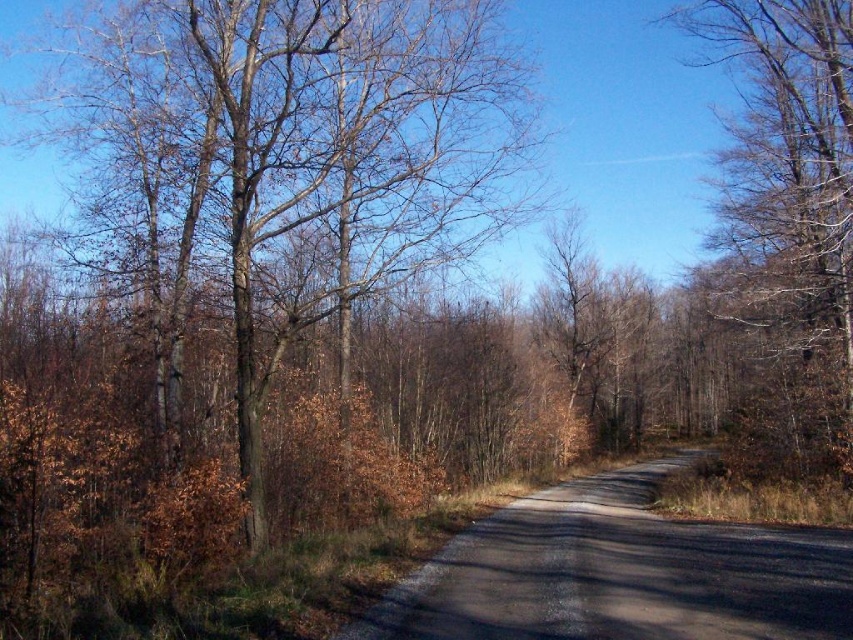
Question: Which point is farther to the camera?

Choices:
 (A) brown bark tree at right
 (B) brown bark tree at left

Answer: (A)

Question: Among these points, which one is nearest to the camera?

Choices:
 (A) (759, 264)
 (B) (233, 136)

Answer: (B)

Question: Where is brown bark tree at left located in relation to brown bark tree at right in the image?

Choices:
 (A) right
 (B) left

Answer: (B)

Question: Is brown bark tree at left wider than brown bark tree at right?

Choices:
 (A) yes
 (B) no

Answer: (A)

Question: Does brown bark tree at left have a smaller size compared to brown bark tree at right?

Choices:
 (A) no
 (B) yes

Answer: (A)